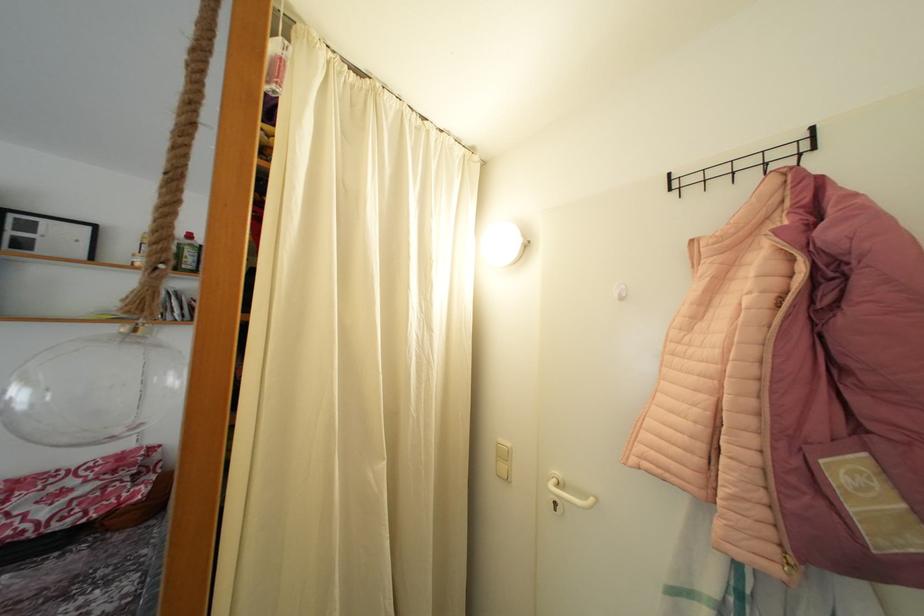
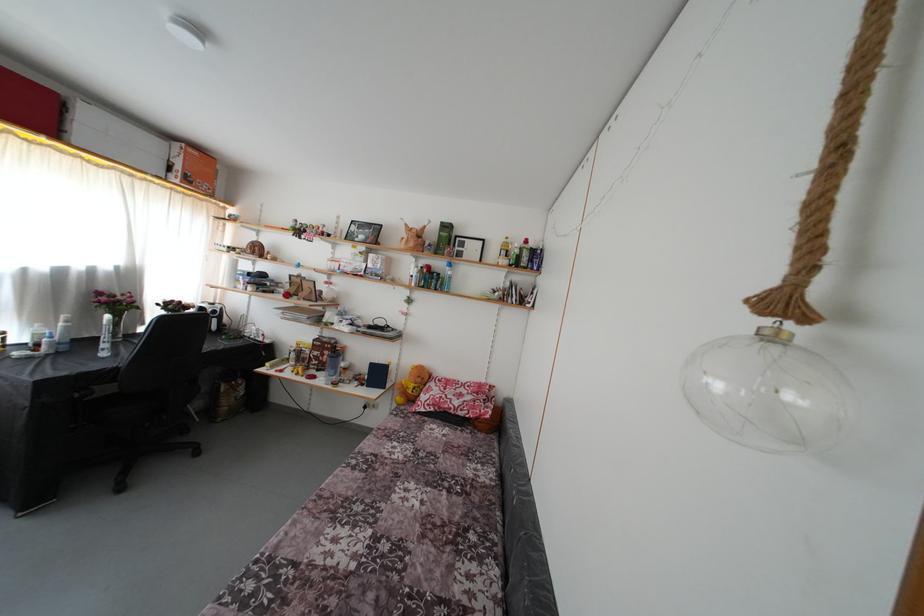
Question: How did the camera likely rotate?

Choices:
 (A) Left
 (B) Right
 (C) Up
 (D) Down

Answer: (A)